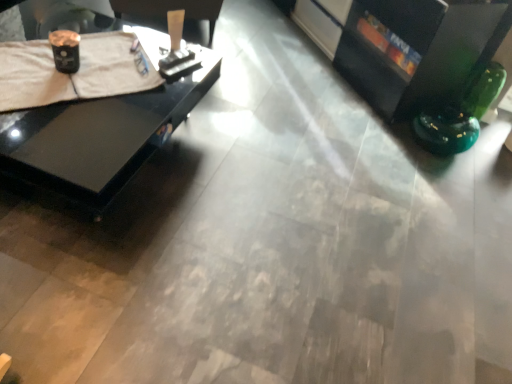
Where is `vacant space in white cloth at upper left (from a real-world perspective)`? Image resolution: width=512 pixels, height=384 pixels. vacant space in white cloth at upper left (from a real-world perspective) is located at coordinates (113, 71).